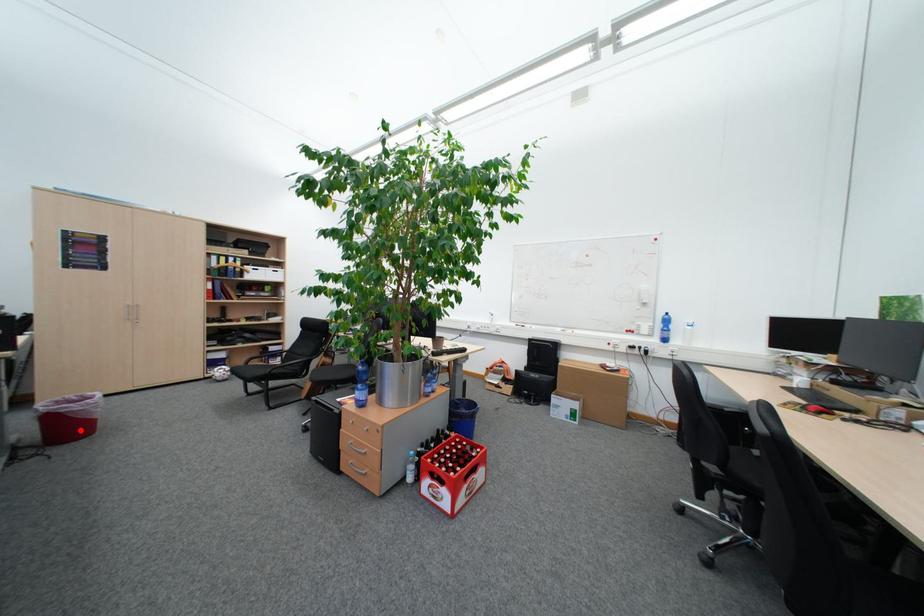
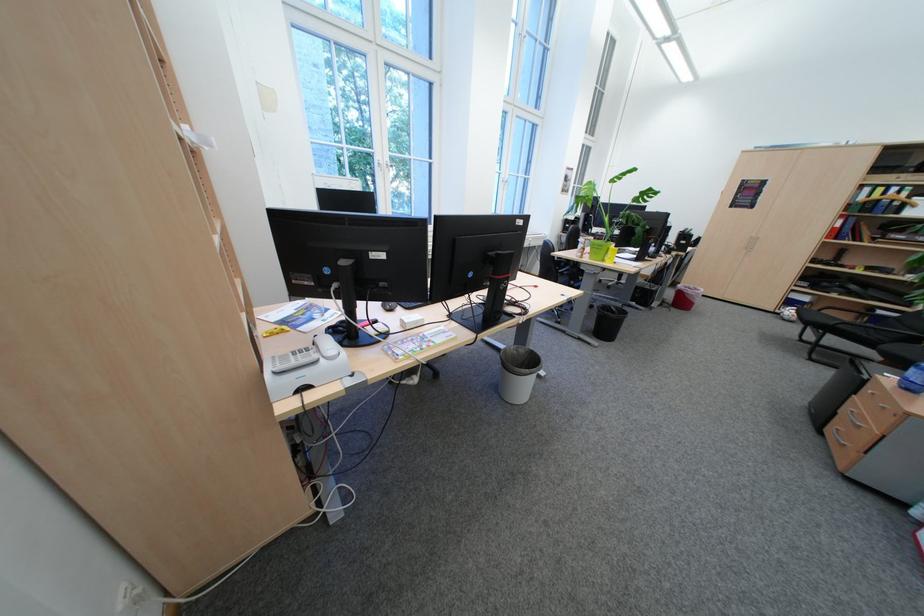
The point at the highlighted location is marked in the first image. Where is the corresponding point in the second image?

(694, 302)